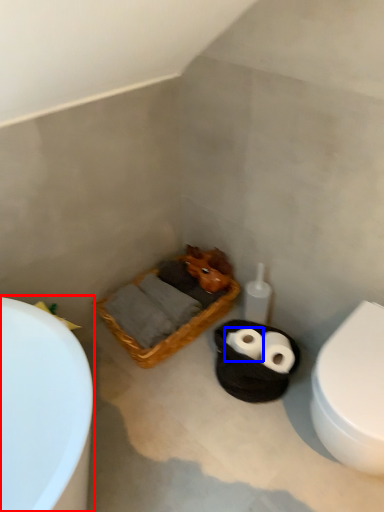
Question: Which object is further to the camera taking this photo, bathtub (highlighted by a red box) or toilet paper (highlighted by a blue box)?

Choices:
 (A) bathtub
 (B) toilet paper

Answer: (B)